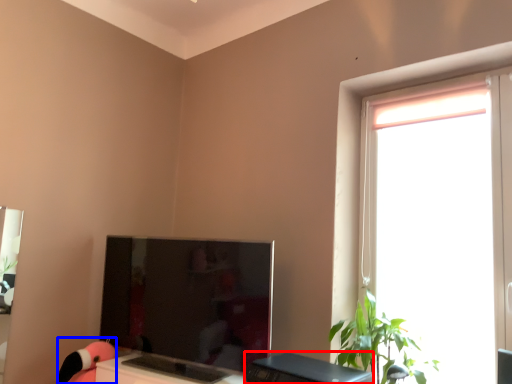
Question: Which of the following is the farthest to the observer, desktop (highlighted by a red box) or toy (highlighted by a blue box)?

Choices:
 (A) desktop
 (B) toy

Answer: (B)